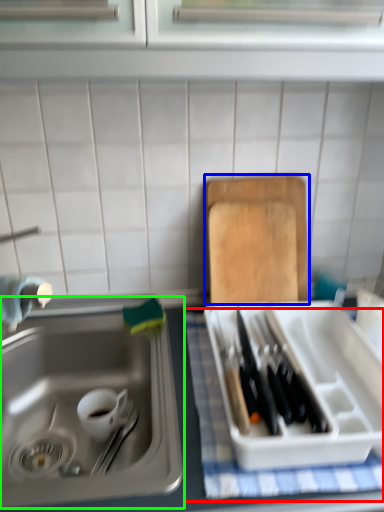
Question: Estimate the real-world distances between objects in this image. Which object is closer to tablecloth (highlighted by a red box), cutting board (highlighted by a blue box) or sink (highlighted by a green box)?

Choices:
 (A) cutting board
 (B) sink

Answer: (B)